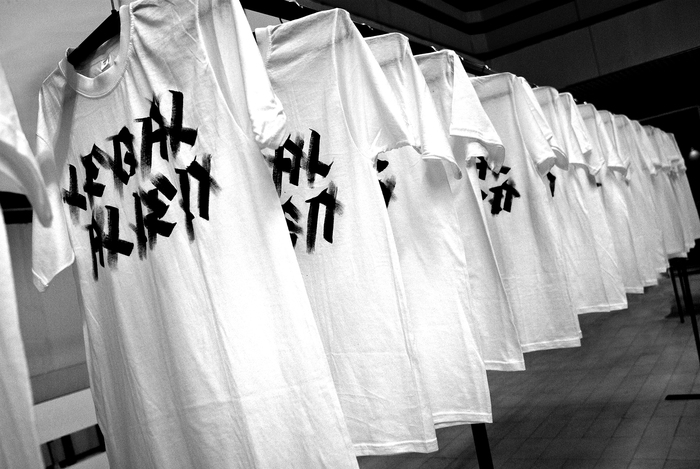
Identify the location of hanger rod. (272, 7).